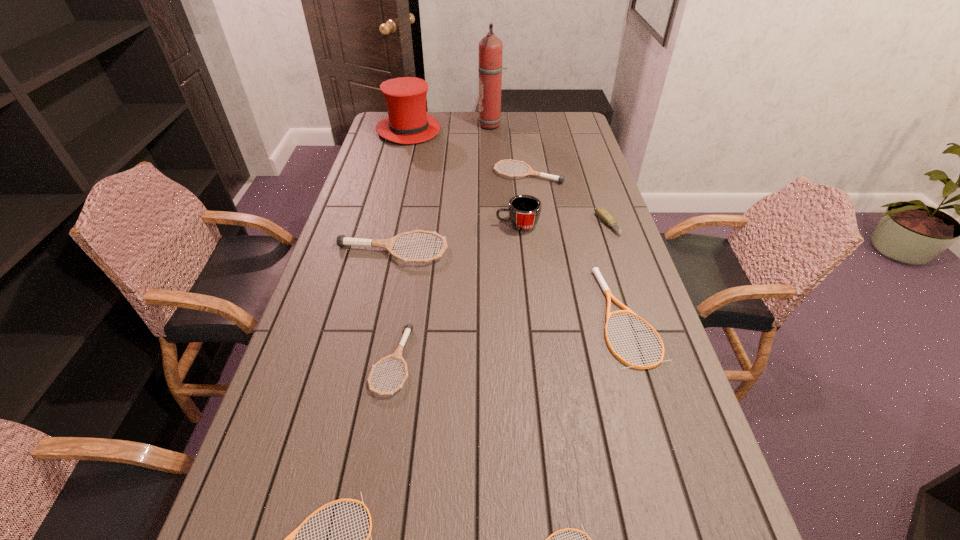
Locate an element on the screen. The height and width of the screenshot is (540, 960). tennis racket located in the left edge section of the desktop is located at coordinates (342, 240).

This screenshot has height=540, width=960. Find the location of `pocketknife that is at the right edge`. pocketknife that is at the right edge is located at coordinates point(604,215).

Where is `object situated at the far left corner`? This screenshot has height=540, width=960. object situated at the far left corner is located at coordinates coord(408,122).

The height and width of the screenshot is (540, 960). I want to click on vacant point at the far edge, so pyautogui.click(x=517, y=120).

In the image, there is a desktop. Identify the location of vacant space at the left edge. The width and height of the screenshot is (960, 540). (357, 263).

Where is `vacant area at the right edge`? The width and height of the screenshot is (960, 540). vacant area at the right edge is located at coordinates tap(579, 261).

You are a GUI agent. You are given a task and a screenshot of the screen. Output one action in this format:
    pyautogui.click(x=<x>, y=<y>)
    Task: Click on the vacant space at the far right corner
    This screenshot has width=960, height=540.
    Given the screenshot: What is the action you would take?
    pyautogui.click(x=550, y=131)

I want to click on vacant space that is in between the farthest tennis racket and the red fire extinguisher, so click(510, 150).

What are the coordinates of `free spot between the gray pocketknife and the red hat` in the screenshot? It's located at (x=508, y=178).

The image size is (960, 540). What are the coordinates of `free space between the farthest gray tennis racket and the red hat` in the screenshot? It's located at (468, 152).